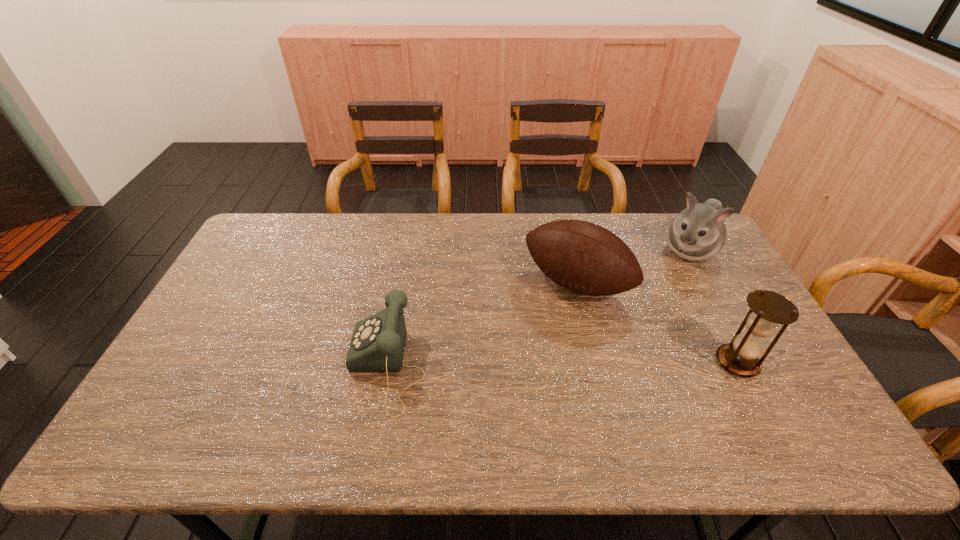
I want to click on vacant space that's between the hamster and the shortest object, so click(x=538, y=309).

Where is `empty space that is in between the leftmost object and the hamster`? empty space that is in between the leftmost object and the hamster is located at coordinates (x=538, y=309).

This screenshot has height=540, width=960. Identify the location of free space between the football and the hourglass. (657, 322).

Locate an element on the screen. empty location between the hourglass and the hamster is located at coordinates (713, 306).

The image size is (960, 540). I want to click on object identified as the second closest to the leftmost object, so click(768, 309).

Identify which object is located as the second nearest to the hamster. Please provide its 2D coordinates. Your answer should be formatted as a tuple, i.e. [(x, y)], where the tuple contains the x and y coordinates of a point satisfying the conditions above.

[(768, 309)]

At what (x,y) coordinates should I click in order to perform the action: click on free space that satisfies the following two spatial constraints: 1. on the front side of the hourglass; 2. on the left side of the second object from left to right. Please return your answer as a coordinate pair (x, y). The image size is (960, 540). Looking at the image, I should click on (595, 362).

You are a GUI agent. You are given a task and a screenshot of the screen. Output one action in this format:
    pyautogui.click(x=<x>, y=<y>)
    Task: Click on the free space in the image that satisfies the following two spatial constraints: 1. on the back side of the hamster; 2. on the right side of the hourglass
    The height and width of the screenshot is (540, 960).
    Given the screenshot: What is the action you would take?
    pyautogui.click(x=680, y=251)

This screenshot has height=540, width=960. What are the coordinates of `vacant space that satisfies the following two spatial constraints: 1. on the back side of the hamster; 2. on the left side of the hourglass` in the screenshot? It's located at (680, 251).